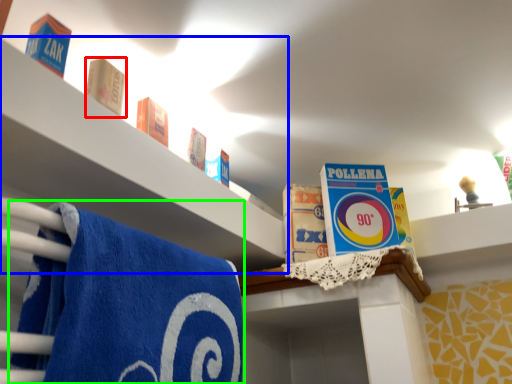
Question: Which object is the farthest from product (highlighted by a red box)? Choose among these: shelf (highlighted by a blue box) or towel (highlighted by a green box).

Choices:
 (A) shelf
 (B) towel

Answer: (B)